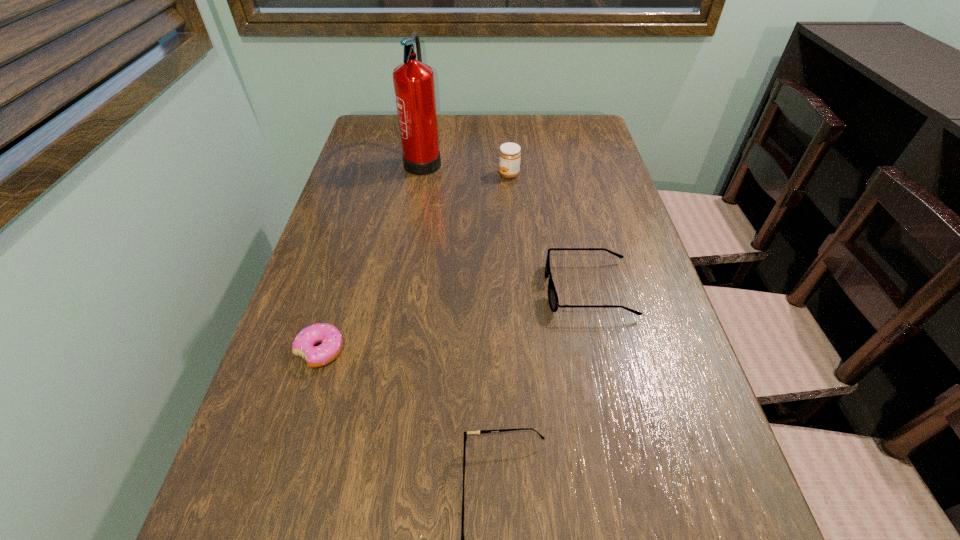
Where is `the tallest object`? the tallest object is located at coordinates (414, 87).

Locate an element on the screen. The image size is (960, 540). the fourth object from right to left is located at coordinates (414, 87).

Identify the location of the second tallest object. (509, 155).

You are a GUI agent. You are given a task and a screenshot of the screen. Output one action in this format:
    pyautogui.click(x=<x>, y=<y>)
    Task: Click on the third nearest object
    
    Given the screenshot: What is the action you would take?
    pyautogui.click(x=553, y=299)

At what (x,y) coordinates should I click in order to perform the action: click on the right spectacles. Please return your answer as a coordinate pair (x, y). The width and height of the screenshot is (960, 540). Looking at the image, I should click on (553, 299).

Find the location of a particular element. This screenshot has height=540, width=960. the leftmost object is located at coordinates (331, 339).

This screenshot has height=540, width=960. Find the location of `doughnut`. doughnut is located at coordinates (331, 339).

You are a GUI agent. You are given a task and a screenshot of the screen. Output one action in this format:
    pyautogui.click(x=<x>, y=<y>)
    Task: Click on the free space located on the right of the fire extinguisher
    Image resolution: width=960 pixels, height=540 pixels.
    Given the screenshot: What is the action you would take?
    pyautogui.click(x=503, y=159)

You are a GUI agent. You are given a task and a screenshot of the screen. Output one action in this format:
    pyautogui.click(x=<x>, y=<y>)
    Task: Click on the vacant area located 0.230m on the front label of the fourth shortest object
    The image size is (960, 540).
    Given the screenshot: What is the action you would take?
    tap(417, 174)

This screenshot has width=960, height=540. Identify the location of free space located 0.060m on the front label of the fourth shortest object. (477, 174).